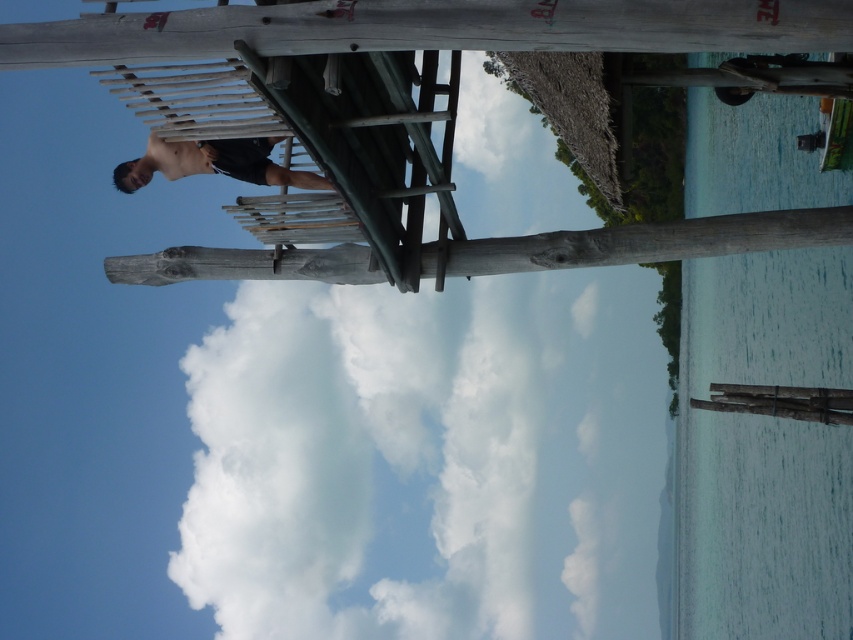
You are a photographer trying to capture the dark brown wood person at center and the white fluffy cloud at upper center in the same frame. Based on their sizes in the image, which one would appear larger in your photo?

The white fluffy cloud at upper center appears larger in the photo because its width is greater than that of the dark brown wood person at center.

You are a photographer trying to capture the person standing on the wooden structure. The natural wood beam at center is blocking part of the view. Can you see the entire dark brown wood person at center without moving your camera position?

The natural wood beam at center is shorter than the dark brown wood person at center, so the person is taller than the beam. This means the beam might block part of the person, but since the person is taller, their upper body and head should still be visible above the beam. Therefore, you can see most of the dark brown wood person at center except the part obscured by the beam.

You are a photographer trying to capture the dark brown wood person at center and the white fluffy cloud at upper center in the same frame. Can you see both objects clearly at the same time?

The dark brown wood person at center is behind the white fluffy cloud at upper center, so the person may be partially obscured by the cloud, making it difficult to see both clearly at the same time.